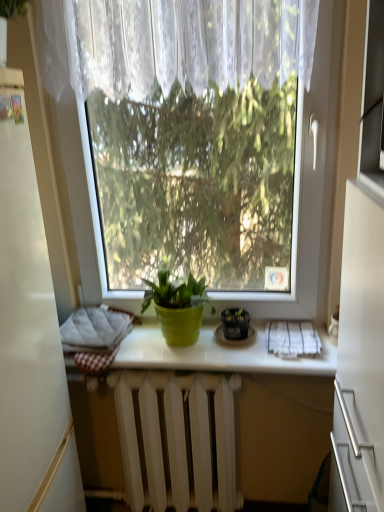
Locate an element on the screen. free space above green matte pot at center (from a real-world perspective) is located at coordinates (194, 338).